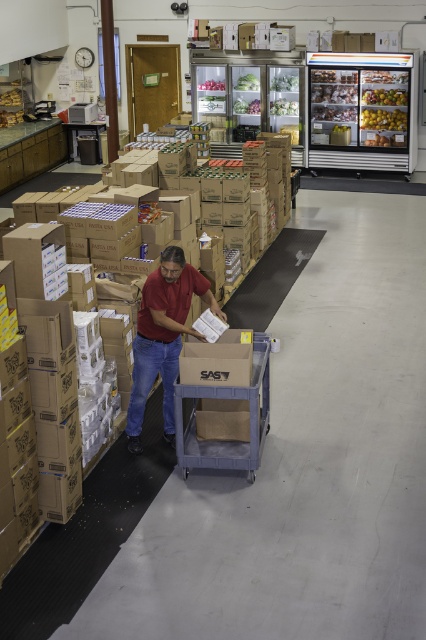
Question: Is matte red shirt at center smaller than shiny plastic apples at upper center?

Choices:
 (A) yes
 (B) no

Answer: (B)

Question: Among these objects, which one is farthest from the camera?

Choices:
 (A) yellow matte apples at upper center
 (B) gray plastic cart at center
 (C) shiny plastic apples at upper center
 (D) matte red shirt at center

Answer: (A)

Question: Which point is farther to the camera?

Choices:
 (A) (405, 97)
 (B) (247, 467)

Answer: (A)

Question: Which point is closer to the camera?

Choices:
 (A) matte red shirt at center
 (B) shiny plastic apples at upper center

Answer: (A)

Question: Is gray plastic cart at center to the left of shiny plastic apples at upper center from the viewer's perspective?

Choices:
 (A) no
 (B) yes

Answer: (B)

Question: Does matte red shirt at center have a greater width compared to yellow matte apples at upper center?

Choices:
 (A) no
 (B) yes

Answer: (B)